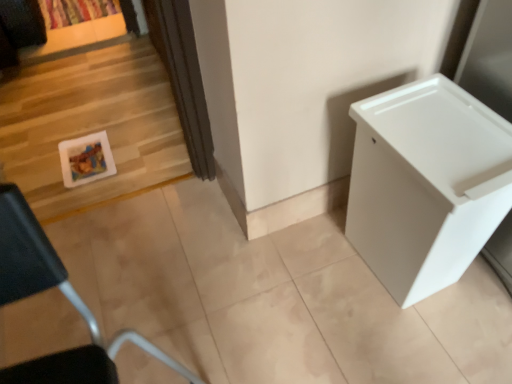
Question: From a real-world perspective, is white plastic changing table at right physically below white glossy picture frame at left?

Choices:
 (A) no
 (B) yes

Answer: (A)

Question: From a real-world perspective, does white plastic changing table at right stand above white glossy picture frame at left?

Choices:
 (A) no
 (B) yes

Answer: (B)

Question: Considering the relative positions of white plastic changing table at right and white glossy picture frame at left in the image provided, is white plastic changing table at right to the right of white glossy picture frame at left from the viewer's perspective?

Choices:
 (A) yes
 (B) no

Answer: (A)

Question: Is white plastic changing table at right not inside white glossy picture frame at left?

Choices:
 (A) no
 (B) yes

Answer: (B)

Question: Considering the relative sizes of white plastic changing table at right and white glossy picture frame at left in the image provided, is white plastic changing table at right bigger than white glossy picture frame at left?

Choices:
 (A) yes
 (B) no

Answer: (A)

Question: Based on their sizes in the image, would you say white glossy picture frame at left is bigger or smaller than multicolored fabric curtain at upper left?

Choices:
 (A) small
 (B) big

Answer: (A)

Question: Considering the positions of point (62, 163) and point (101, 13), is point (62, 163) closer or farther from the camera than point (101, 13)?

Choices:
 (A) farther
 (B) closer

Answer: (B)

Question: In the image, is white glossy picture frame at left positioned in front of or behind multicolored fabric curtain at upper left?

Choices:
 (A) behind
 (B) front

Answer: (B)

Question: Based on their positions, is white glossy picture frame at left located to the left or right of multicolored fabric curtain at upper left?

Choices:
 (A) left
 (B) right

Answer: (B)

Question: Is multicolored fabric curtain at upper left taller or shorter than white plastic changing table at right?

Choices:
 (A) short
 (B) tall

Answer: (A)

Question: In terms of size, does multicolored fabric curtain at upper left appear bigger or smaller than white plastic changing table at right?

Choices:
 (A) small
 (B) big

Answer: (A)

Question: From a real-world perspective, is multicolored fabric curtain at upper left positioned above or below white plastic changing table at right?

Choices:
 (A) above
 (B) below

Answer: (B)

Question: Visually, is multicolored fabric curtain at upper left positioned to the left or to the right of white plastic changing table at right?

Choices:
 (A) left
 (B) right

Answer: (A)

Question: In terms of height, does multicolored fabric curtain at upper left look taller or shorter compared to white plastic container at lower left?

Choices:
 (A) tall
 (B) short

Answer: (B)

Question: In the image, is multicolored fabric curtain at upper left on the left side or the right side of white plastic container at lower left?

Choices:
 (A) right
 (B) left

Answer: (B)